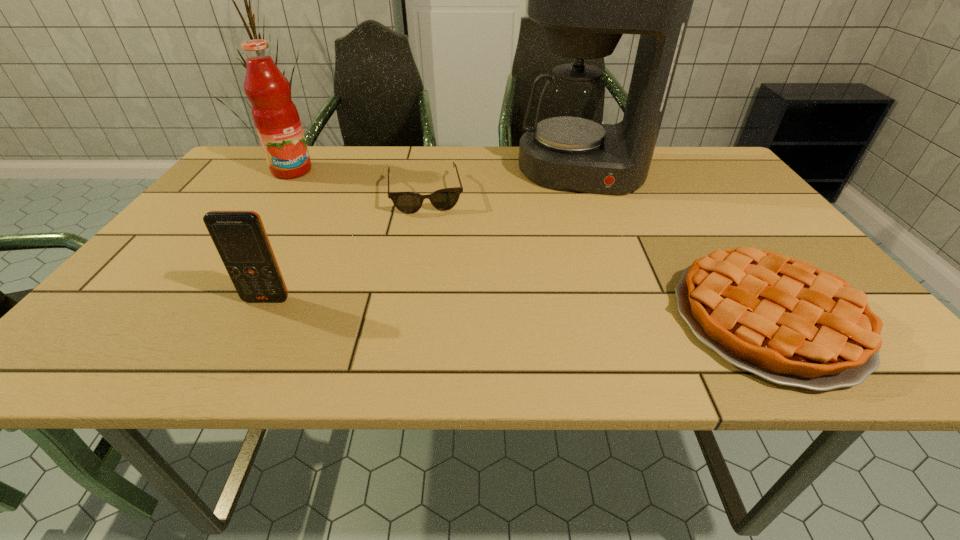
At what (x,y) coordinates should I click in order to perform the action: click on vacant space on the desktop that is between the cellular telephone and the pie and is positioned on the front lenses of the sunglasses. Please return your answer as a coordinate pair (x, y). Looking at the image, I should click on (441, 306).

This screenshot has height=540, width=960. I want to click on free space on the desktop that is between the third tallest object and the pie and is positioned on the button side of the tallest object, so click(x=586, y=312).

You are a GUI agent. You are given a task and a screenshot of the screen. Output one action in this format:
    pyautogui.click(x=<x>, y=<y>)
    Task: Click on the free space on the desktop that is between the third tallest object and the pie and is positioned on the front label of the fourth shortest object
    
    Given the screenshot: What is the action you would take?
    point(442,306)